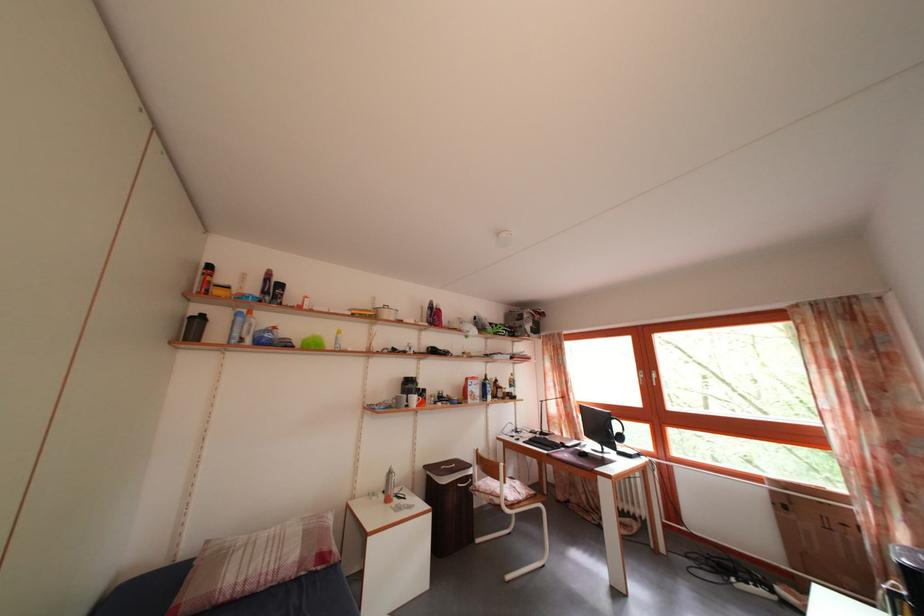
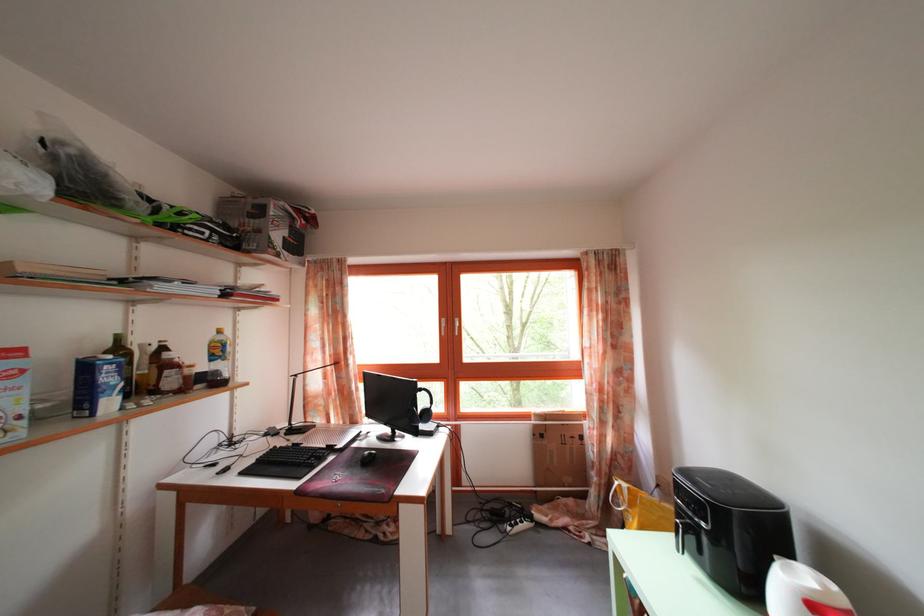
In the second image, find the point that corresponds to [493,383] in the first image.

(126, 346)